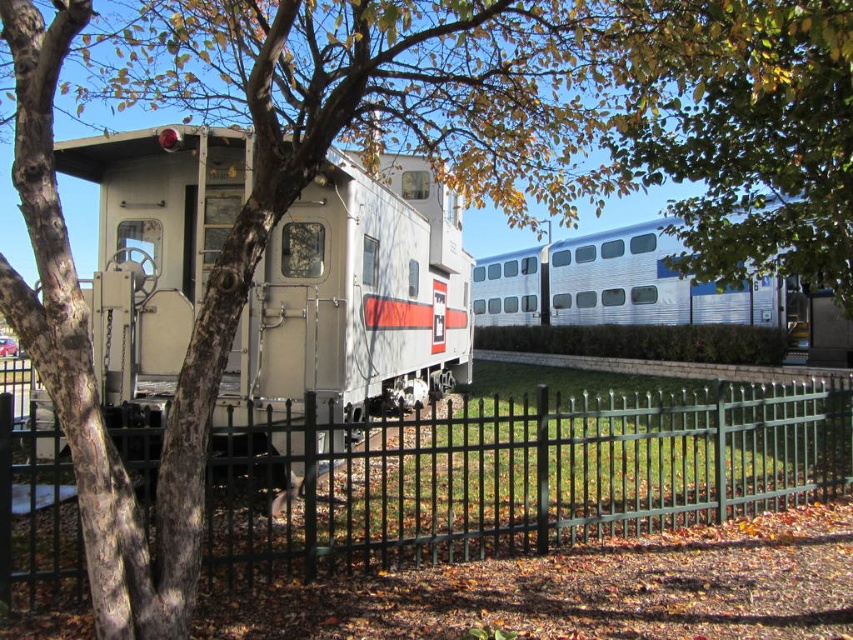
Is green metal fence at center thinner than silver metallic caboose at center?

In fact, green metal fence at center might be wider than silver metallic caboose at center.

You are a GUI agent. You are given a task and a screenshot of the screen. Output one action in this format:
    pyautogui.click(x=<x>, y=<y>)
    Task: Click on the green metal fence at center
    
    Given the screenshot: What is the action you would take?
    pyautogui.click(x=537, y=476)

Find the location of a particular element. green metal fence at center is located at coordinates (537, 476).

Can you confirm if green metal fence at center is positioned below silver metallic train at center?

Correct, green metal fence at center is located below silver metallic train at center.

From the picture: Who is more distant from viewer, (625, 515) or (831, 337)?

Positioned behind is point (831, 337).

Image resolution: width=853 pixels, height=640 pixels. Identify the location of green metal fence at center. (537, 476).

Who is more forward, (173, 193) or (786, 164)?

Point (786, 164) is more forward.

Measure the distance between silver metallic caboose at center and green leafy tree at upper center.

silver metallic caboose at center and green leafy tree at upper center are 6.16 meters apart from each other.

Locate an element on the screen. This screenshot has width=853, height=640. silver metallic caboose at center is located at coordinates (350, 307).

You are a GUI agent. You are given a task and a screenshot of the screen. Output one action in this format:
    pyautogui.click(x=<x>, y=<y>)
    Task: Click on the silver metallic caboose at center
    
    Given the screenshot: What is the action you would take?
    pyautogui.click(x=350, y=307)